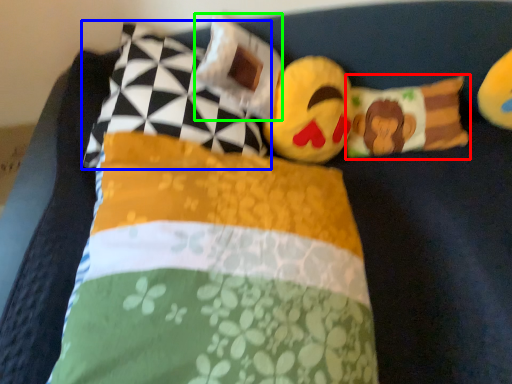
Question: Which is nearer to the pillow (highlighted by a red box)? pillow (highlighted by a blue box) or pillow (highlighted by a green box).

Choices:
 (A) pillow
 (B) pillow

Answer: (B)